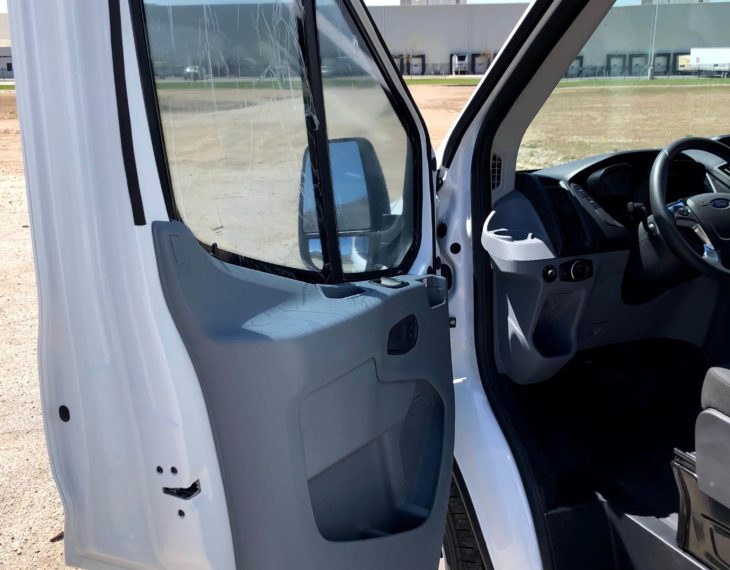
At what (x,y) coordinates should I click in order to perform the action: click on window. Please return your answer as a coordinate pair (x, y). The image size is (730, 570). Looking at the image, I should click on (231, 218), (368, 231), (529, 162).